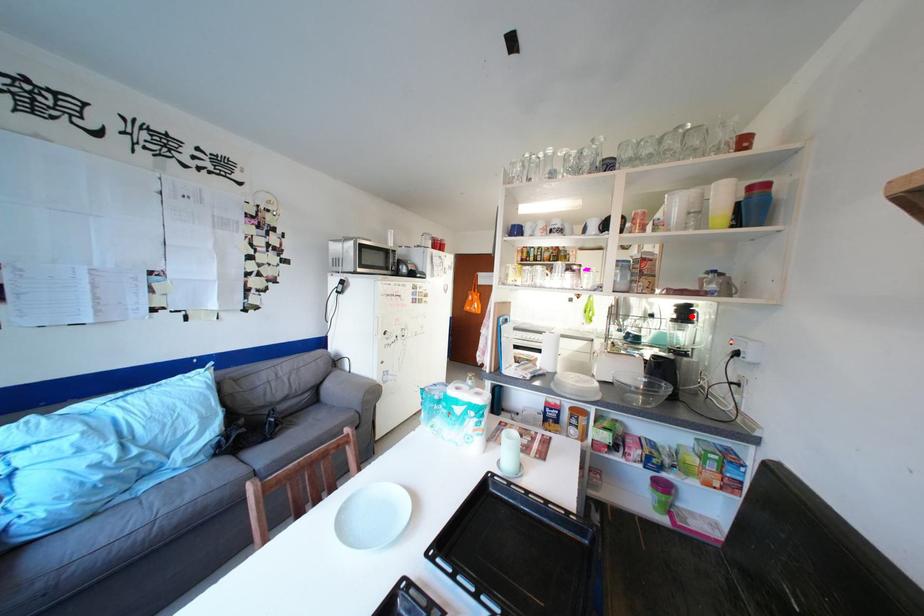
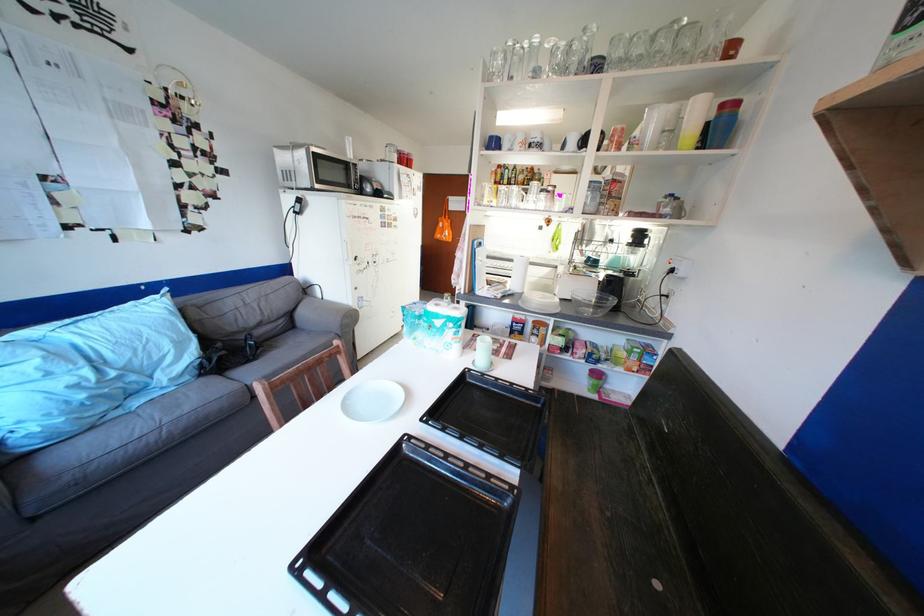
Where in the second image is the point corresponding to the highlighted location from the first image?

(647, 241)